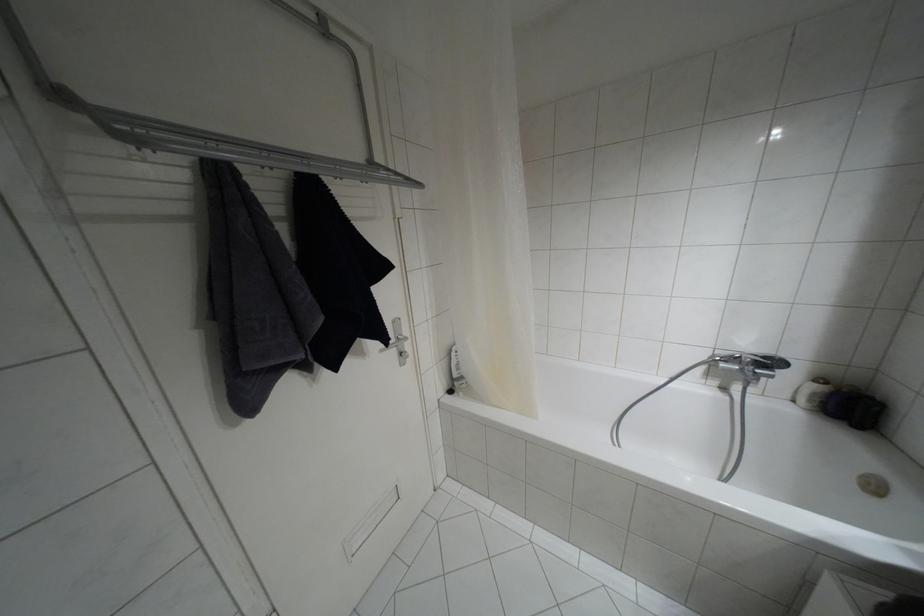
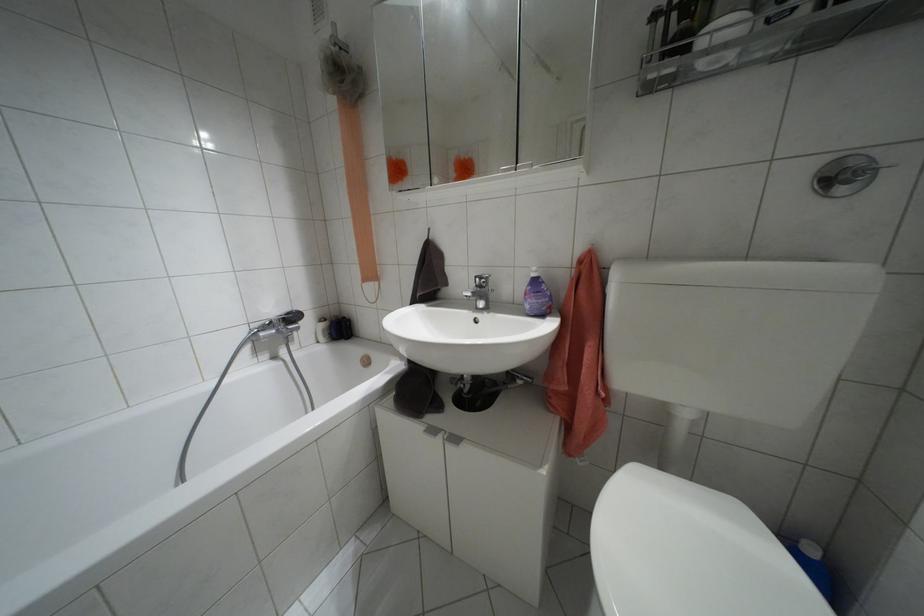
Locate, in the second image, the point that corresponds to point 763,357 in the first image.

(286, 313)